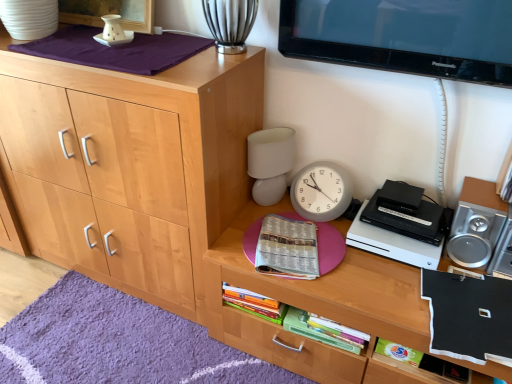
Question: In terms of size, does natural wood cabinet at left appear bigger or smaller than wooden desk at center?

Choices:
 (A) big
 (B) small

Answer: (A)

Question: In the image, is natural wood cabinet at left on the left side or the right side of wooden desk at center?

Choices:
 (A) right
 (B) left

Answer: (B)

Question: Based on their relative distances, which object is nearer to the purple soft rug at lower left?

Choices:
 (A) printed paper book at center, positioned as the 1th book in left-to-right order
 (B) natural wood cabinet at left
 (C) white matte table lamp at center-right
 (D) black matte book at lower right, the 3th book from the left
 (E) black plastic dvd player at right

Answer: (B)

Question: Considering the real-world distances, which object is farthest from the black plastic dvd player at right?

Choices:
 (A) wooden desk at center
 (B) white matte table lamp at center-right
 (C) natural wood cabinet at left
 (D) purple soft rug at lower left
 (E) green matte book at lower right, marked as the second book in a right-to-left arrangement

Answer: (D)